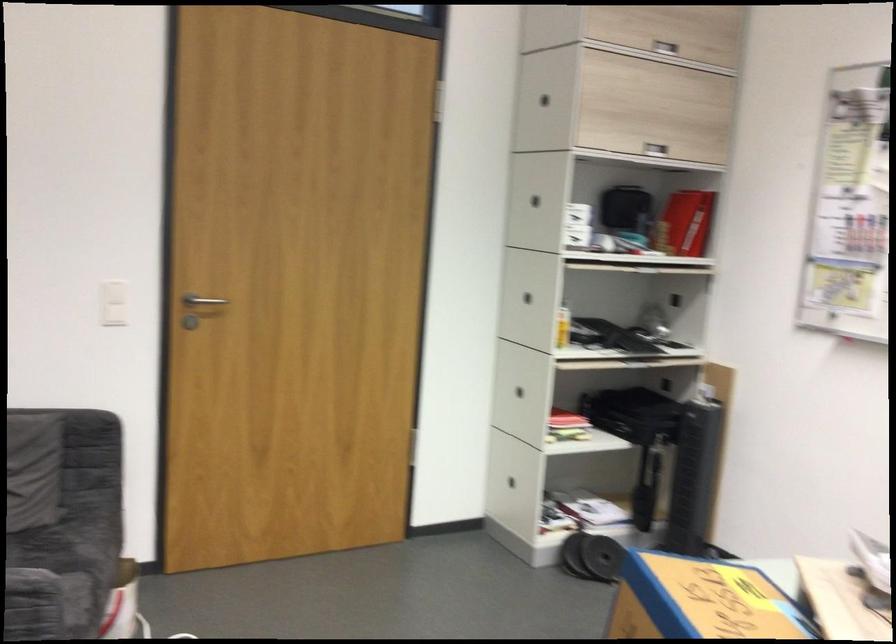
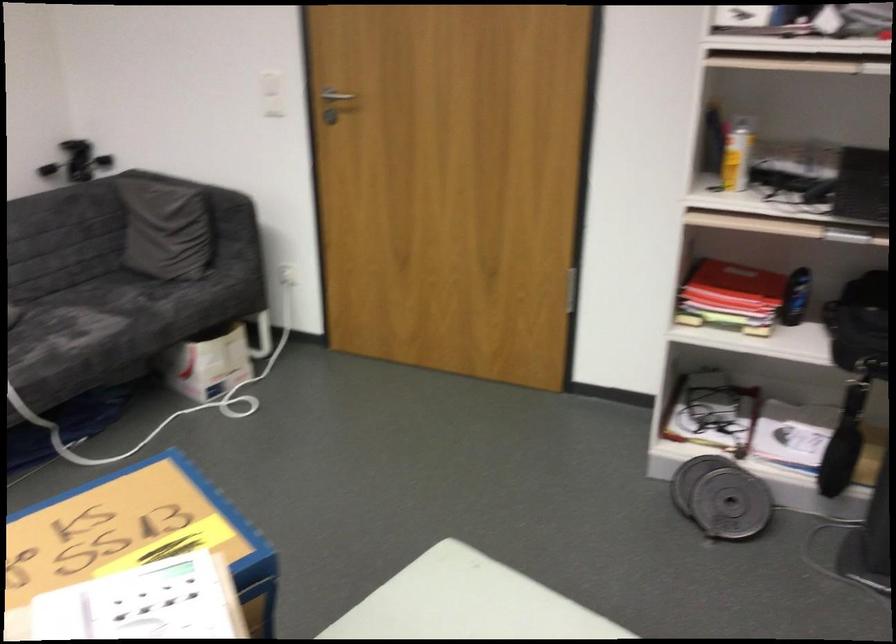
The point at (x=567, y=323) is marked in the first image. Where is the corresponding point in the second image?

(736, 158)